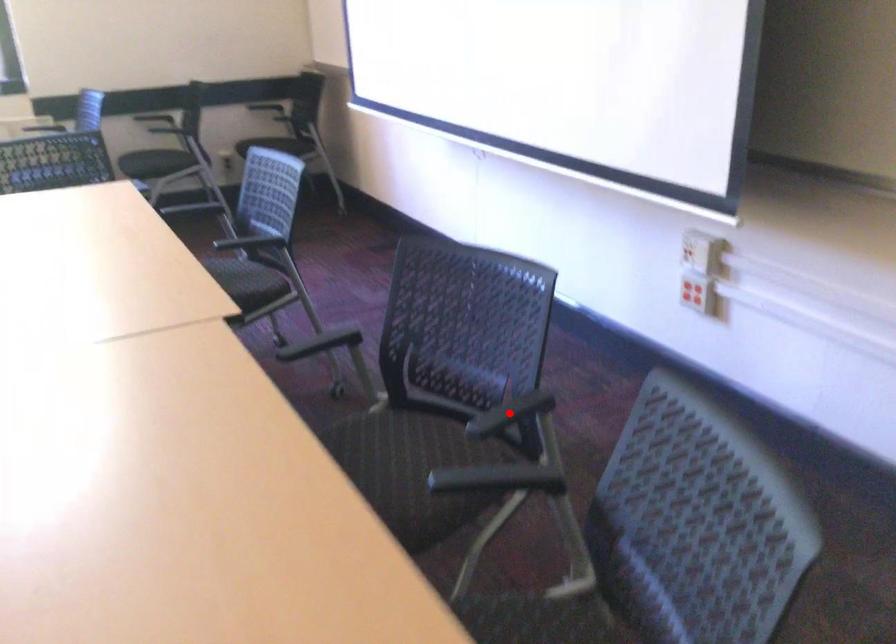
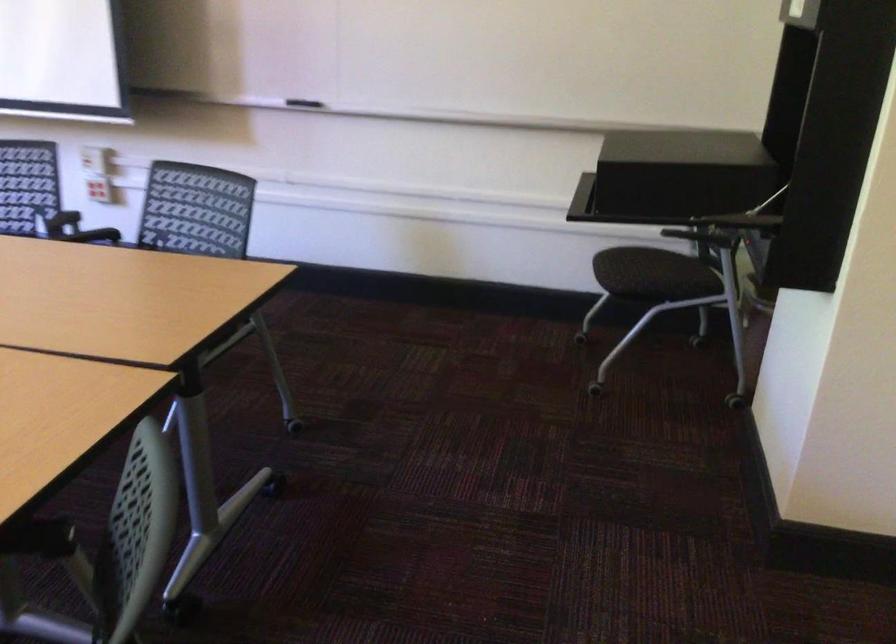
Question: I am providing you with two images of the same scene from different viewpoints. A red point is marked on the first image. Is the red point's position out of view in image 2?

Choices:
 (A) Yes
 (B) No

Answer: (A)